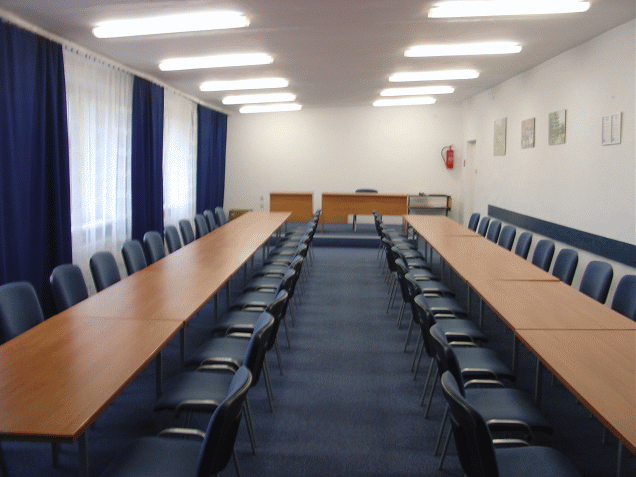
What are the coordinates of `tables on right` in the screenshot? It's located at (595, 357), (568, 320), (511, 263), (460, 227), (430, 212).